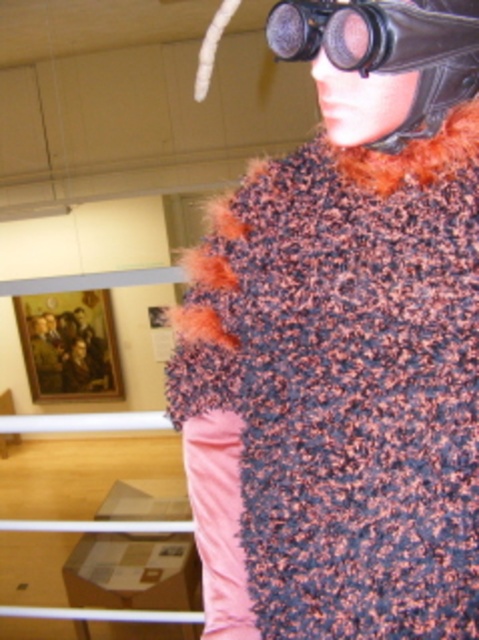
Does fuzzy multicolored scarf at upper center lie behind black leather goggles at upper center?

That is True.

Is fuzzy multicolored scarf at upper center to the right of black leather goggles at upper center from the viewer's perspective?

In fact, fuzzy multicolored scarf at upper center is to the left of black leather goggles at upper center.

At what (x,y) coordinates should I click in order to perform the action: click on fuzzy multicolored scarf at upper center. Please return your answer as a coordinate pair (x, y). This screenshot has height=640, width=479. Looking at the image, I should click on (343, 344).

Image resolution: width=479 pixels, height=640 pixels. In order to click on fuzzy multicolored scarf at upper center in this screenshot , I will do `click(343, 344)`.